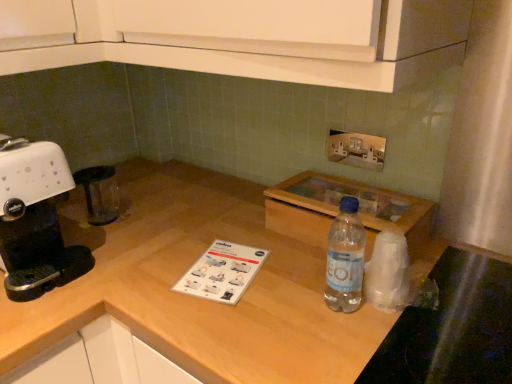
You are a GUI agent. You are given a task and a screenshot of the screen. Output one action in this format:
    pyautogui.click(x=<x>, y=<y>)
    Task: Click on the metallic silver outlet at upper center
    This screenshot has height=384, width=512.
    Given the screenshot: What is the action you would take?
    pyautogui.click(x=356, y=149)

The image size is (512, 384). In order to click on transparent plastic bag at right in this screenshot , I will do `click(388, 273)`.

Find the location of `clear plastic bottle at center`. clear plastic bottle at center is located at coordinates (345, 258).

In order to click on metallic silver outlet at upper center in this screenshot , I will do `click(356, 149)`.

Does point (351, 141) come in front of point (356, 225)?

No, (351, 141) is further to viewer.

Does metallic silver outlet at upper center turn towards clear plastic bottle at center?

Yes, metallic silver outlet at upper center is facing clear plastic bottle at center.

How different are the orientations of metallic silver outlet at upper center and clear plastic bottle at center in degrees?

3.24 degrees.

Looking at the image, does metallic silver outlet at upper center seem bigger or smaller compared to clear plastic bottle at center?

Clearly, metallic silver outlet at upper center is smaller in size than clear plastic bottle at center.

Considering the points (260, 317) and (395, 303), which point is in front, point (260, 317) or point (395, 303)?

The point (260, 317) is more forward.

From the image's perspective, is wooden at center under transparent plastic bag at right?

Yes.

Is the position of wooden at center more distant than that of transparent plastic bag at right?

No, it is not.

Does wooden at center have a lesser width compared to transparent plastic bag at right?

Incorrect, the width of wooden at center is not less than that of transparent plastic bag at right.

Locate an element on the screen. bottle below the white plastic coffee machine at left (from a real-world perspective) is located at coordinates (345, 258).

Consider the image. Is clear plastic bottle at center situated inside white plastic coffee machine at left or outside?

clear plastic bottle at center is outside white plastic coffee machine at left.

Does clear plastic bottle at center have a lesser height compared to white plastic coffee machine at left?

Yes.

From a real-world perspective, which object rests below the other?

clear plastic bottle at center.

Is transparent plastic bag at right not within metallic silver outlet at upper center?

Indeed, transparent plastic bag at right is completely outside metallic silver outlet at upper center.

Is the depth of transparent plastic bag at right less than that of metallic silver outlet at upper center?

Yes, transparent plastic bag at right is in front of metallic silver outlet at upper center.

In terms of size, does transparent plastic bag at right appear bigger or smaller than metallic silver outlet at upper center?

transparent plastic bag at right is bigger than metallic silver outlet at upper center.

From a real-world perspective, which object rests below the other?

In real-world perspective, transparent plastic bag at right is lower.

From the image's perspective, is metallic silver outlet at upper center on wooden at center?

A: Yes.

Is metallic silver outlet at upper center in front of wooden at center?

No, metallic silver outlet at upper center is behind wooden at center.

In terms of width, does metallic silver outlet at upper center look wider or thinner when compared to wooden at center?

metallic silver outlet at upper center is thinner than wooden at center.

How many degrees apart are the facing directions of metallic silver outlet at upper center and wooden at center?

1.05 degrees separate the facing orientations of metallic silver outlet at upper center and wooden at center.

Between point (383, 285) and point (358, 290), which one is positioned in front?

The point (383, 285) is closer.

Is clear plastic bottle at center located within transparent plastic bag at right?

No, clear plastic bottle at center is not a part of transparent plastic bag at right.

Which of these two, transparent plastic bag at right or clear plastic bottle at center, stands taller?

Standing taller between the two is clear plastic bottle at center.

Choose the correct answer: Is clear plastic bottle at center inside transparent plastic bag at right or outside it?

clear plastic bottle at center is outside transparent plastic bag at right.

Locate an element on the screen. Image resolution: width=512 pixels, height=384 pixels. paper towel behind the clear plastic bottle at center is located at coordinates (388, 273).

Can you confirm if clear plastic bottle at center is taller than transparent plastic bag at right?

Correct, clear plastic bottle at center is much taller as transparent plastic bag at right.

Is clear plastic bottle at center bigger than transparent plastic bag at right?

Actually, clear plastic bottle at center might be smaller than transparent plastic bag at right.

Find the location of a particular element. bottle lying below the metallic silver outlet at upper center (from the image's perspective) is located at coordinates (345, 258).

You are a GUI agent. You are given a task and a screenshot of the screen. Output one action in this format:
    pyautogui.click(x=<x>, y=<y>)
    Task: Click on the paper towel behind the wooden at center
    
    Given the screenshot: What is the action you would take?
    pyautogui.click(x=388, y=273)

Considering their positions, is white plastic coffee machine at left positioned further to clear plastic bottle at center than wooden at center?

white plastic coffee machine at left lies further to clear plastic bottle at center than the other object.

Estimate the real-world distances between objects in this image. Which object is closer to white plastic coffee machine at left, transparent plastic bag at right or wooden at center?

wooden at center is positioned closer to the anchor white plastic coffee machine at left.

Based on their spatial positions, is wooden at center or clear plastic bottle at center further from transparent plastic bag at right?

Among the two, wooden at center is located further to transparent plastic bag at right.

Which object lies nearer to the anchor point metallic silver outlet at upper center, clear plastic bottle at center or wooden at center?

clear plastic bottle at center lies closer to metallic silver outlet at upper center than the other object.

In the scene shown: When comparing their distances from wooden at center, does white plastic coffee machine at left or metallic silver outlet at upper center seem closer?

white plastic coffee machine at left lies closer to wooden at center than the other object.

Considering their positions, is white plastic coffee machine at left positioned closer to metallic silver outlet at upper center than clear plastic bottle at center?

Based on the image, clear plastic bottle at center appears to be nearer to metallic silver outlet at upper center.

When comparing their distances from clear plastic bottle at center, does metallic silver outlet at upper center or wooden at center seem further?

Among the two, metallic silver outlet at upper center is located further to clear plastic bottle at center.

From the image, which object appears to be farther from transparent plastic bag at right, clear plastic bottle at center or metallic silver outlet at upper center?

Among the two, metallic silver outlet at upper center is located further to transparent plastic bag at right.

This screenshot has width=512, height=384. What are the coordinates of `bottle between white plastic coffee machine at left and metallic silver outlet at upper center` in the screenshot? It's located at (345, 258).

Identify the location of paper towel between clear plastic bottle at center and wooden at center vertically. (388, 273).

In order to click on countertop between white plastic coffee machine at left and transparent plastic bag at right from left to right in this screenshot , I will do `click(195, 297)`.

Where is `countertop between white plastic coffee machine at left and clear plastic bottle at center`? The height and width of the screenshot is (384, 512). countertop between white plastic coffee machine at left and clear plastic bottle at center is located at coordinates (195, 297).